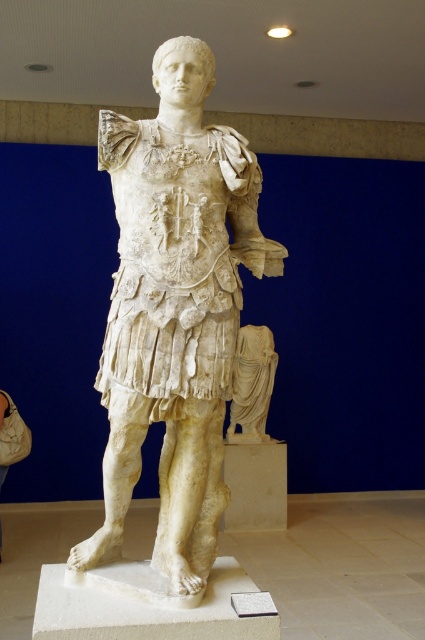
From the picture: Can you confirm if white marble pedestal at center is shorter than white marble draped cloth at center?

Indeed, white marble pedestal at center has a lesser height compared to white marble draped cloth at center.

Is point (209, 595) farther from camera compared to point (238, 372)?

No, it is not.

Who is more forward, (141, 612) or (257, 419)?

Positioned in front is point (141, 612).

This screenshot has width=425, height=640. I want to click on white marble pedestal at center, so click(x=144, y=611).

Looking at this image, does white marble statue at center have a smaller size compared to white marble draped cloth at center?

Actually, white marble statue at center might be larger than white marble draped cloth at center.

Can you confirm if white marble statue at center is bigger than white marble draped cloth at center?

Correct, white marble statue at center is larger in size than white marble draped cloth at center.

Where is `white marble statue at center`? white marble statue at center is located at coordinates (x=175, y=308).

Where is `white marble statue at center`? white marble statue at center is located at coordinates click(175, 308).

Who is shorter, white marble statue at center or white marble pedestal at center?

white marble pedestal at center is shorter.

Identify the location of white marble statue at center. (175, 308).

Does point (195, 60) lie in front of point (246, 628)?

No, it is behind (246, 628).

The image size is (425, 640). Find the location of `white marble statue at center`. white marble statue at center is located at coordinates (x=175, y=308).